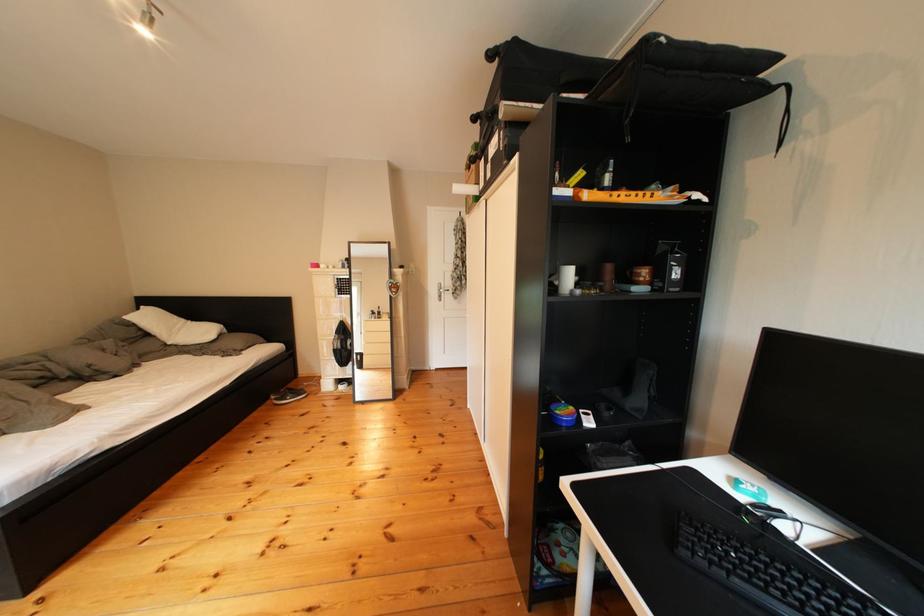
Which object does [640,275] point to?

This point indicates the brown coffee mug.